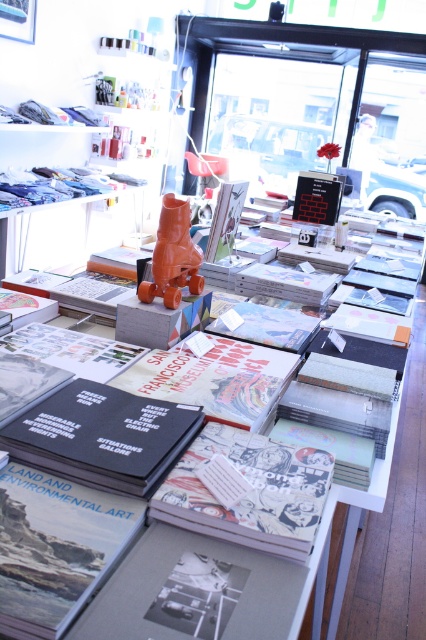
Question: Is matte black book at center to the right of orange matte sculpture at center from the viewer's perspective?

Choices:
 (A) no
 (B) yes

Answer: (A)

Question: Does matte black book at center lie in front of orange matte sculpture at center?

Choices:
 (A) yes
 (B) no

Answer: (A)

Question: Observing the image, what is the correct spatial positioning of comic book paper at center in reference to orange matte sculpture at center?

Choices:
 (A) left
 (B) right

Answer: (B)

Question: Which point is farther to the camera?

Choices:
 (A) (287, 445)
 (B) (20, 556)

Answer: (A)

Question: Which is nearer to the orange matte sculpture at center?

Choices:
 (A) matte black book at center
 (B) comic book paper at center

Answer: (B)

Question: Which object appears closest to the camera in this image?

Choices:
 (A) matte black book at center
 (B) comic book paper at center
 (C) orange matte sculpture at center

Answer: (A)